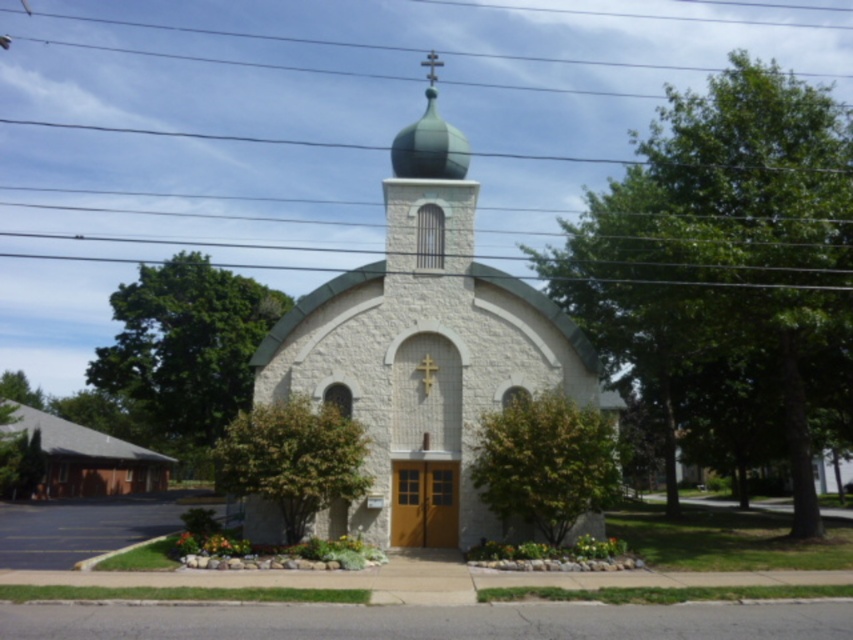
Which is more to the left, white stone church at center or green matte dome at center?

From the viewer's perspective, green matte dome at center appears more on the left side.

In the scene shown: Is white stone church at center below green matte dome at center?

Yes.

The width and height of the screenshot is (853, 640). I want to click on white stone church at center, so click(x=424, y=352).

You are a GUI agent. You are given a task and a screenshot of the screen. Output one action in this format:
    pyautogui.click(x=<x>, y=<y>)
    Task: Click on the white stone church at center
    The width and height of the screenshot is (853, 640).
    Given the screenshot: What is the action you would take?
    pyautogui.click(x=424, y=352)